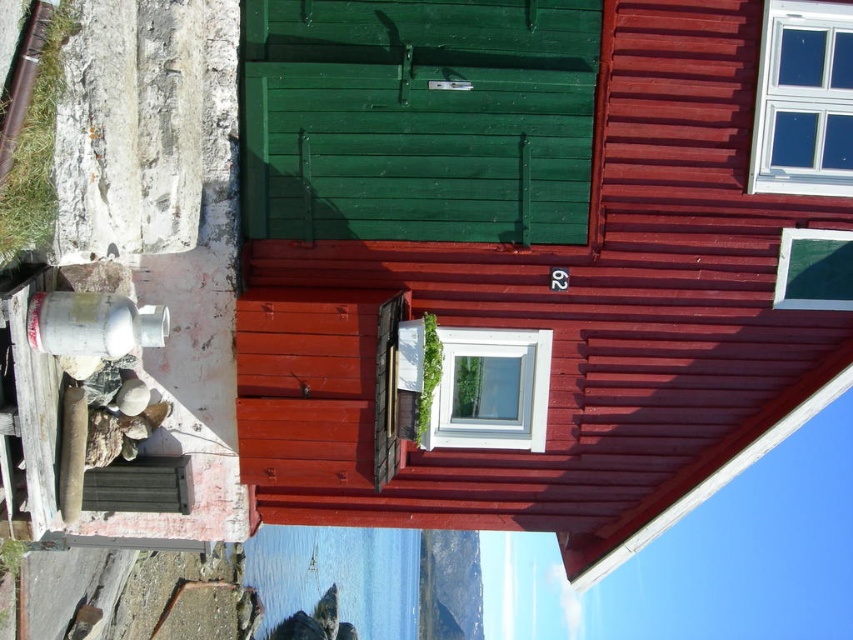
You are a delivery person trying to deliver a package to the house. The package is too large to fit through the white plastic window at center. Can you deliver it through the green wooden door at center instead?

The green wooden door at center is bigger than the white plastic window at center, so yes, the package can be delivered through the green wooden door at center instead.

You are an interior designer assessing the house. The client wants to know which window, the white plastic window at center or the green matte window at upper center, has a greater width. Based on the description, which one is wider?

The white plastic window at center is wider than the green matte window at upper center.